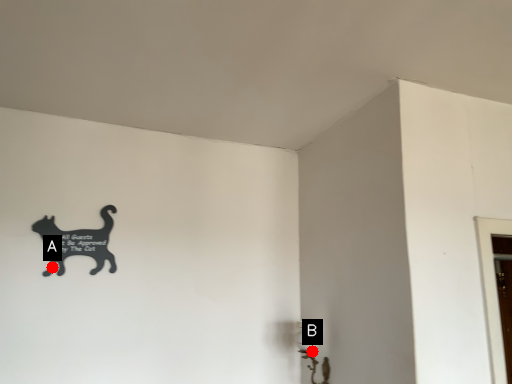
Question: Two points are circled on the image, labeled by A and B beside each circle. Which point is closer to the camera?

Choices:
 (A) A is closer
 (B) B is closer

Answer: (A)